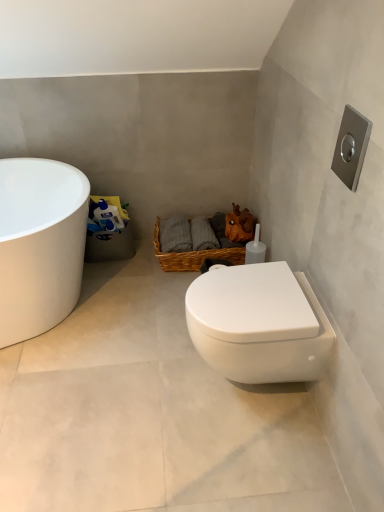
Question: In terms of width, does woven brown basket at center look wider or thinner when compared to white glossy toilet at lower right?

Choices:
 (A) thin
 (B) wide

Answer: (A)

Question: Considering the positions of point (203, 253) and point (105, 298), is point (203, 253) closer or farther from the camera than point (105, 298)?

Choices:
 (A) farther
 (B) closer

Answer: (A)

Question: Which object is the closest to the white glossy toilet at lower right?

Choices:
 (A) woven brown basket at center
 (B) white glossy bathtub at left
 (C) white glossy toilet at lower right

Answer: (C)

Question: Estimate the real-world distances between objects in this image. Which object is closer to the white glossy toilet at lower right?

Choices:
 (A) woven brown basket at center
 (B) white glossy bathtub at left
 (C) white glossy toilet at lower right

Answer: (C)